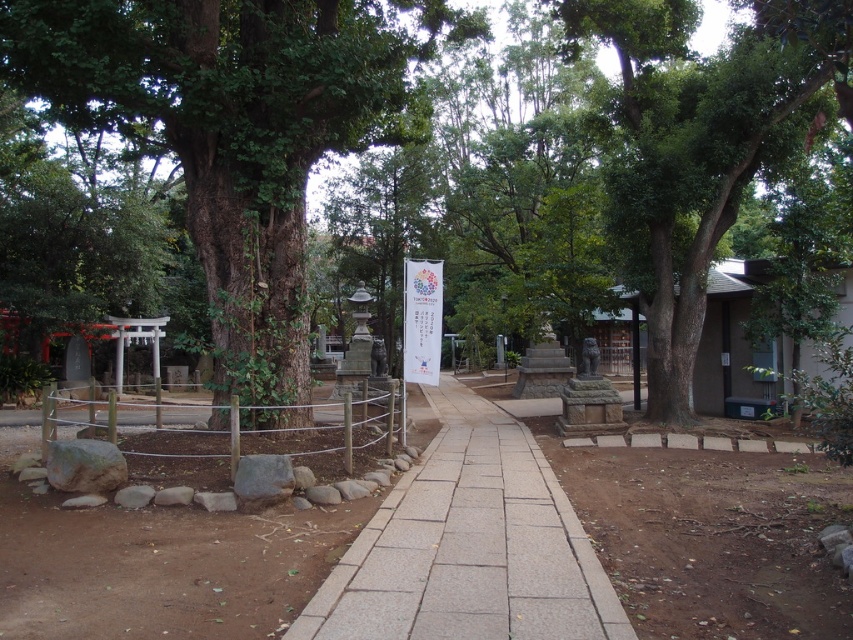
You are a visitor at the shrine and want to take a photo of both the green rough bark tree at center and the green leafy tree at center. Which tree should you move closer to in order to capture both in the same frame?

To capture both the green rough bark tree at center and the green leafy tree at center in the same frame, you should move closer to the green rough bark tree at center because the green leafy tree at center is behind it.

You are a visitor walking along the gray stone pavement at center in the shrine grounds. You want to take a photo of the green leafy tree at center without any obstructions. Is the tree visible from your current position on the pavement?

The green leafy tree at center is above the gray stone pavement at center, so yes, the tree is visible from the pavement without any obstructions.